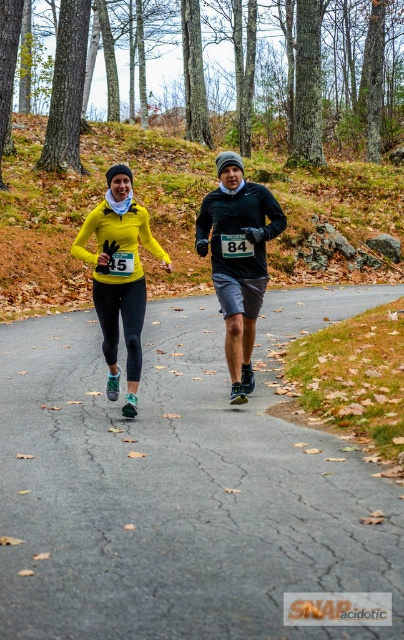
Does matte asphalt road at center have a smaller size compared to yellow matte running top at center?

Actually, matte asphalt road at center might be larger than yellow matte running top at center.

Does matte asphalt road at center have a greater width compared to yellow matte running top at center?

Correct, the width of matte asphalt road at center exceeds that of yellow matte running top at center.

Find the location of a particular element. matte asphalt road at center is located at coordinates (180, 484).

Which is in front, point (128, 248) or point (100, 298)?

Point (128, 248) is in front.

How distant is yellow matte running top at center from matte yellow jacket at center?

The distance of yellow matte running top at center from matte yellow jacket at center is 1.00 meters.

Where is `yellow matte running top at center`? The image size is (404, 640). yellow matte running top at center is located at coordinates (239, 259).

Locate an element on the screen. The image size is (404, 640). yellow matte running top at center is located at coordinates (239, 259).

Does matte black jacket at center lie behind matte yellow jacket at center?

That is True.

Does matte black jacket at center have a greater height compared to matte yellow jacket at center?

Indeed, matte black jacket at center has a greater height compared to matte yellow jacket at center.

You are a GUI agent. You are given a task and a screenshot of the screen. Output one action in this format:
    pyautogui.click(x=<x>, y=<y>)
    Task: Click on the matte black jacket at center
    
    Given the screenshot: What is the action you would take?
    pyautogui.click(x=237, y=259)